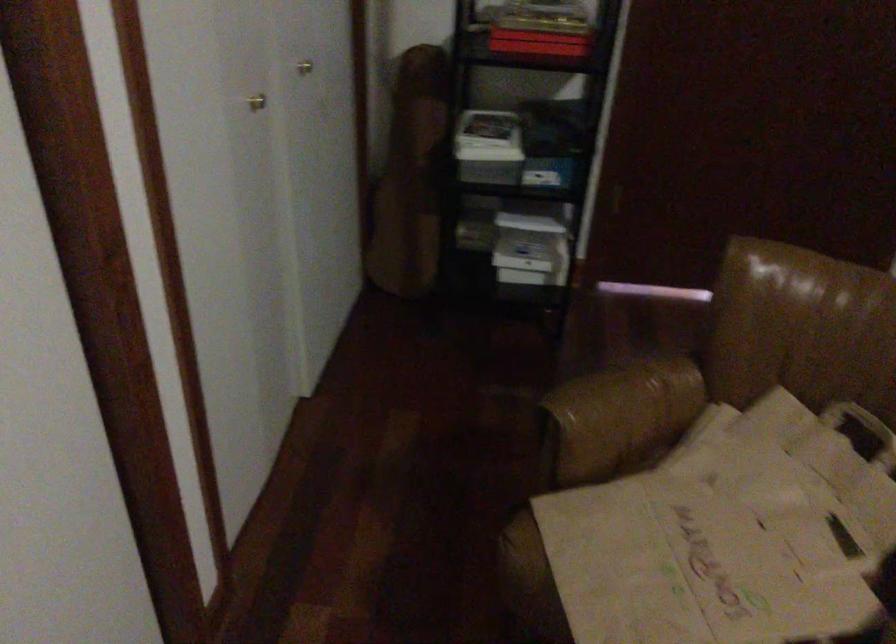
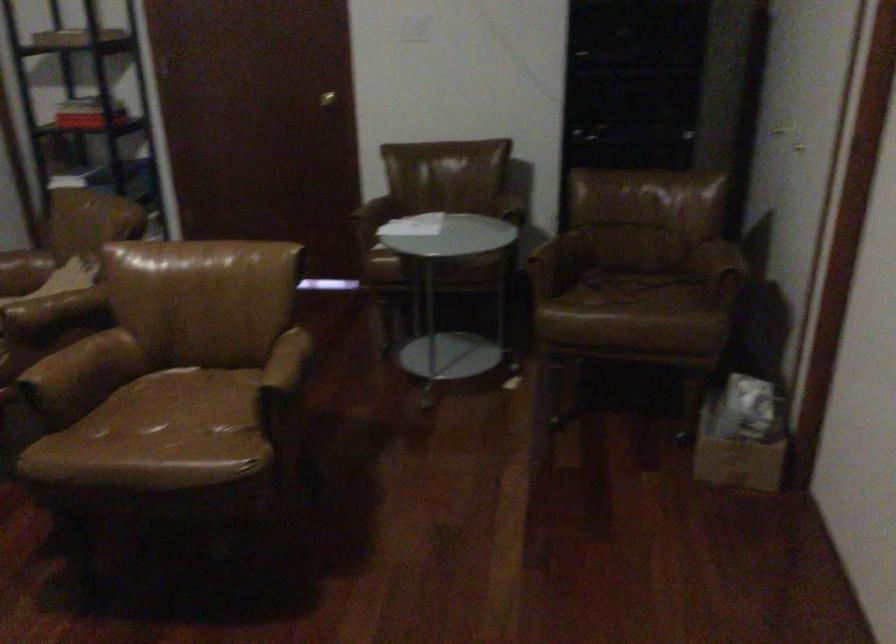
The images are taken continuously from a first-person perspective. In which direction are you moving?

The cameraman moved toward right, backward.